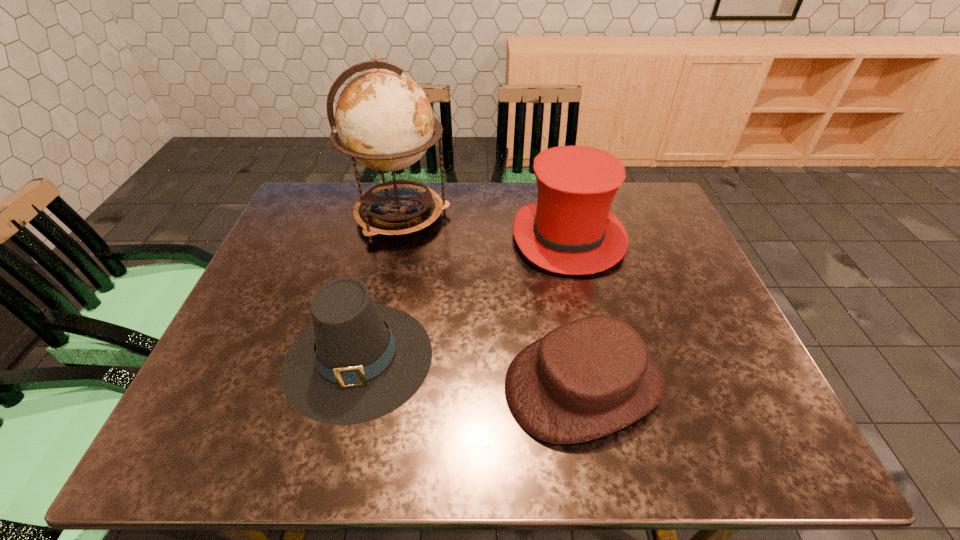
Identify the location of the tallest object. The image size is (960, 540). (385, 121).

Find the location of `the farthest hat`. the farthest hat is located at coordinates (570, 230).

Locate an element on the screen. The image size is (960, 540). the third shortest object is located at coordinates (570, 230).

Locate an element on the screen. This screenshot has height=540, width=960. the third tallest object is located at coordinates (358, 361).

At what (x,y) coordinates should I click in order to perform the action: click on the leftmost hat. Please return your answer as a coordinate pair (x, y). The width and height of the screenshot is (960, 540). Looking at the image, I should click on (358, 361).

Where is `the shortest object`? This screenshot has height=540, width=960. the shortest object is located at coordinates (591, 377).

Find the location of `free space located 0.330m at the center of the globe`. free space located 0.330m at the center of the globe is located at coordinates (559, 216).

Where is `free spot located on the front of the tallest hat`? This screenshot has height=540, width=960. free spot located on the front of the tallest hat is located at coordinates (603, 388).

Locate an element on the screen. The image size is (960, 540). blank space located 0.050m on the front-facing side of the second shortest hat is located at coordinates (336, 450).

Identify the location of vacant region located 0.210m on the back of the shortest hat. This screenshot has width=960, height=540. (562, 269).